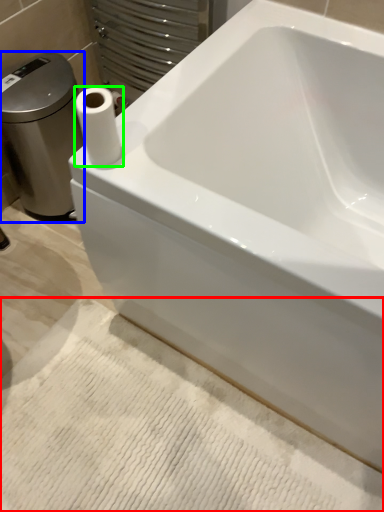
Question: Considering the real-world distances, which object is farthest from bath mat (highlighted by a red box)? porcelain (highlighted by a blue box) or paper towel (highlighted by a green box)?

Choices:
 (A) porcelain
 (B) paper towel

Answer: (A)